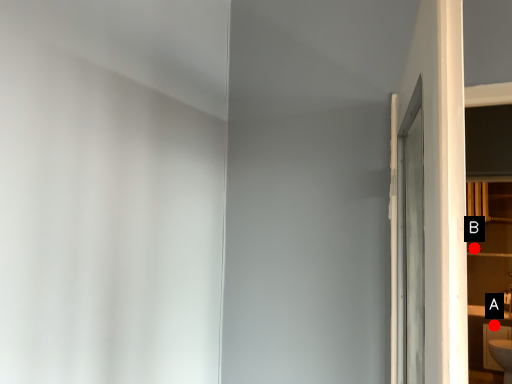
Question: Two points are circled on the image, labeled by A and B beside each circle. Which point is farther from the camera taking this photo?

Choices:
 (A) A is further
 (B) B is further

Answer: (B)